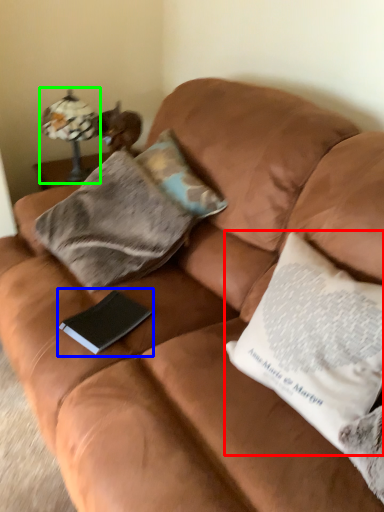
Question: Which is nearer to the pillow (highlighted by a red box)? paperback book (highlighted by a blue box) or lamp (highlighted by a green box).

Choices:
 (A) paperback book
 (B) lamp

Answer: (A)